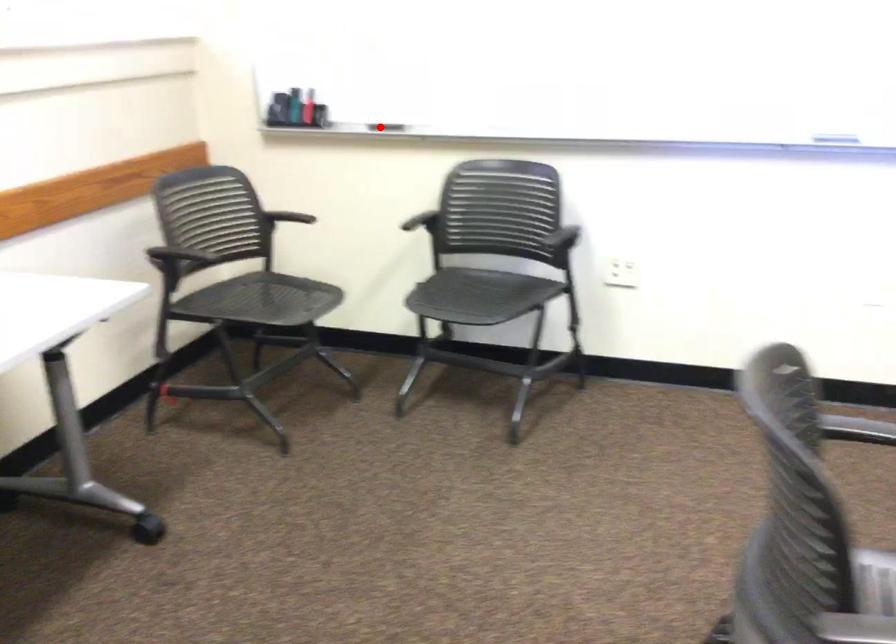
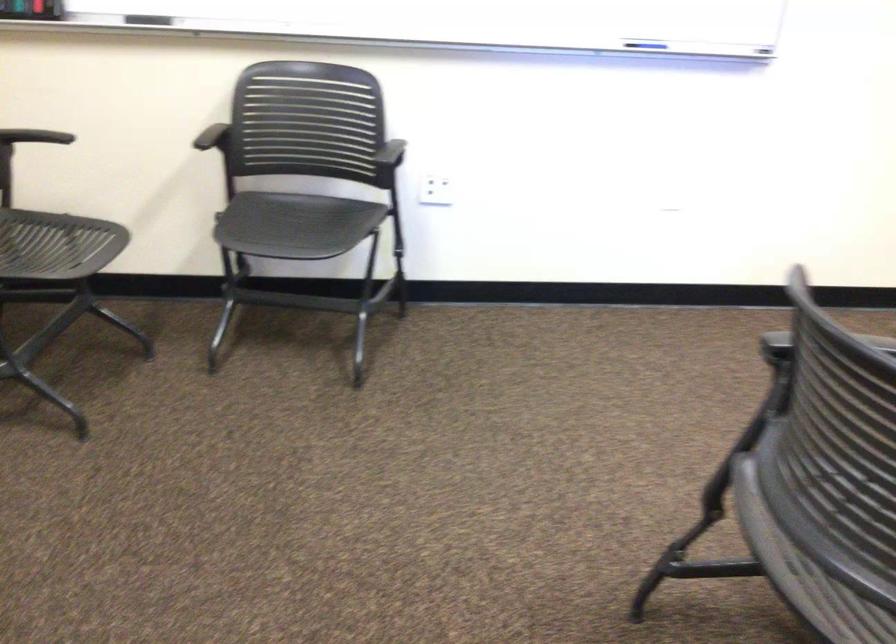
Question: I am providing you with two images of the same scene from different viewpoints. A red point is shown in image1. For the corresponding object point in image2, is it positioned nearer or farther from the camera?

Choices:
 (A) Nearer
 (B) Farther

Answer: (A)